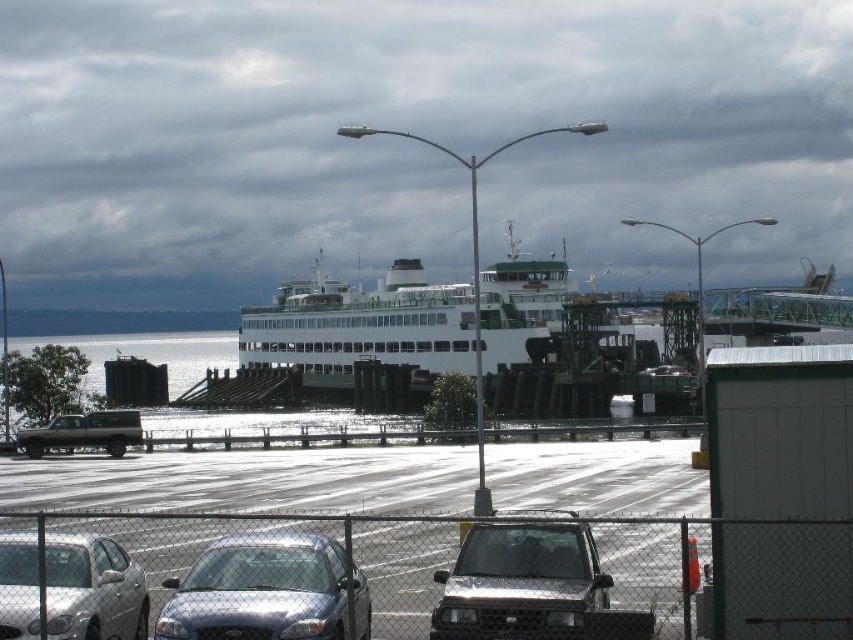
Who is more distant from viewer, (x=263, y=612) or (x=509, y=616)?

The point (x=263, y=612) is more distant.

Which is below, satin silver sedan at center or shiny silver suv at center?

Positioned lower is satin silver sedan at center.

I want to click on satin silver sedan at center, so click(267, 589).

The width and height of the screenshot is (853, 640). Find the location of `satin silver sedan at center`. satin silver sedan at center is located at coordinates (267, 589).

Which of these two, satin silver sedan at center or silver metallic sedan at lower left, stands taller?

silver metallic sedan at lower left

Is satin silver sedan at center positioned before silver metallic sedan at lower left?

Yes, it is.

You are a GUI agent. You are given a task and a screenshot of the screen. Output one action in this format:
    pyautogui.click(x=<x>, y=<y>)
    Task: Click on the satin silver sedan at center
    
    Given the screenshot: What is the action you would take?
    pyautogui.click(x=267, y=589)

Between point (541, 308) and point (6, 595), which one is positioned behind?

The point (541, 308) is behind.

Between white matte ferry at center and silver metallic sedan at lower left, which one has more height?

white matte ferry at center

Who is more distant from viewer, (494, 324) or (126, 600)?

Point (494, 324)

The image size is (853, 640). I want to click on white matte ferry at center, so click(x=361, y=326).